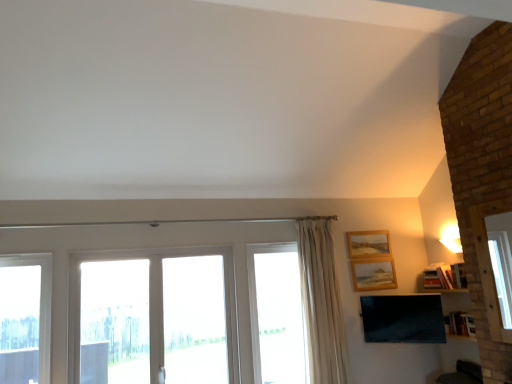
Question: Is clear glass window at left, arranged as the 1th window when viewed from the left, outside wooden picture frame at upper right, marked as the first picture frame in a top-to-bottom arrangement?

Choices:
 (A) no
 (B) yes

Answer: (B)

Question: From a real-world perspective, is clear glass window at left, arranged as the 1th window when viewed from the left, physically above wooden picture frame at upper right, marked as the first picture frame in a top-to-bottom arrangement?

Choices:
 (A) yes
 (B) no

Answer: (B)

Question: Is clear glass window at left, which appears as the 3th window when viewed from the right, to the right of wooden picture frame at upper right, which appears as the second picture frame when ordered from the bottom, from the viewer's perspective?

Choices:
 (A) yes
 (B) no

Answer: (B)

Question: From the image's perspective, would you say clear glass window at left, which appears as the 3th window when viewed from the right, is positioned over wooden picture frame at upper right, which appears as the second picture frame when ordered from the bottom?

Choices:
 (A) yes
 (B) no

Answer: (B)

Question: Does clear glass window at left, which appears as the 3th window when viewed from the right, come behind wooden picture frame at upper right, marked as the first picture frame in a top-to-bottom arrangement?

Choices:
 (A) no
 (B) yes

Answer: (A)

Question: Is beige fabric curtain at center wider or thinner than transparent glass door at center, the 2th window when ordered from right to left?

Choices:
 (A) wide
 (B) thin

Answer: (A)

Question: Is beige fabric curtain at center taller or shorter than transparent glass door at center, the 2th window when ordered from right to left?

Choices:
 (A) short
 (B) tall

Answer: (B)

Question: Is point (321, 271) closer or farther from the camera than point (187, 332)?

Choices:
 (A) closer
 (B) farther

Answer: (B)

Question: From a real-world perspective, relative to transparent glass door at center, arranged as the second window when viewed from the left, is beige fabric curtain at center vertically above or below?

Choices:
 (A) below
 (B) above

Answer: (B)

Question: Is transparent glass screen door at center inside the boundaries of wooden picture frame at upper right, marked as the 1th picture frame in a bottom-to-top arrangement, or outside?

Choices:
 (A) inside
 (B) outside

Answer: (B)

Question: From their relative heights in the image, would you say transparent glass screen door at center is taller or shorter than wooden picture frame at upper right, marked as the 1th picture frame in a bottom-to-top arrangement?

Choices:
 (A) tall
 (B) short

Answer: (A)

Question: Considering the positions of point (211, 372) and point (374, 281), is point (211, 372) closer or farther from the camera than point (374, 281)?

Choices:
 (A) closer
 (B) farther

Answer: (A)

Question: Looking at the image, does transparent glass screen door at center seem bigger or smaller compared to wooden picture frame at upper right, positioned as the second picture frame in top-to-bottom order?

Choices:
 (A) big
 (B) small

Answer: (A)

Question: Is transparent glass screen door at center situated inside beige fabric curtain at center or outside?

Choices:
 (A) outside
 (B) inside

Answer: (A)

Question: Relative to beige fabric curtain at center, is transparent glass screen door at center in front or behind?

Choices:
 (A) front
 (B) behind

Answer: (A)